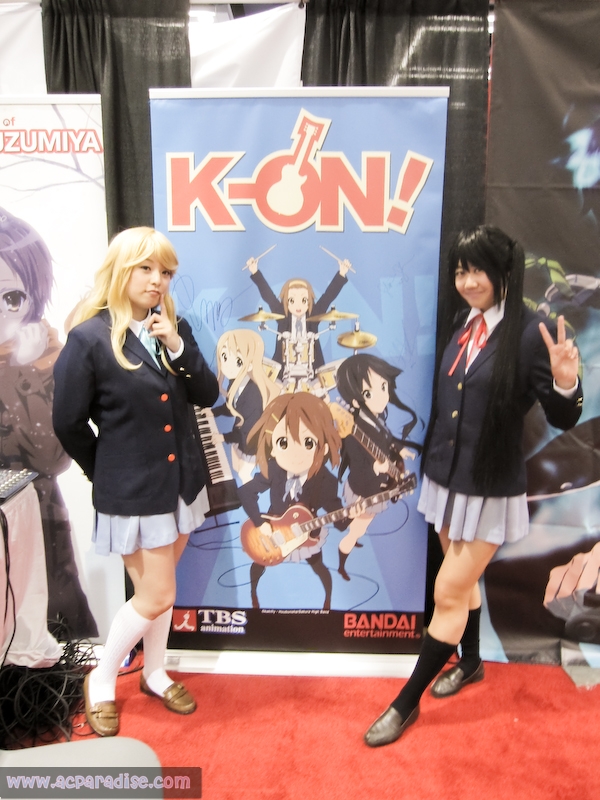
Find the location of a particular element. red carpet is located at coordinates (451, 769).